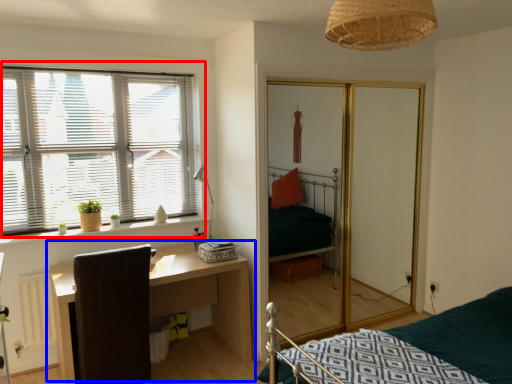
Question: Among these objects, which one is nearest to the camera, window (highlighted by a red box) or table (highlighted by a blue box)?

Choices:
 (A) window
 (B) table

Answer: (B)